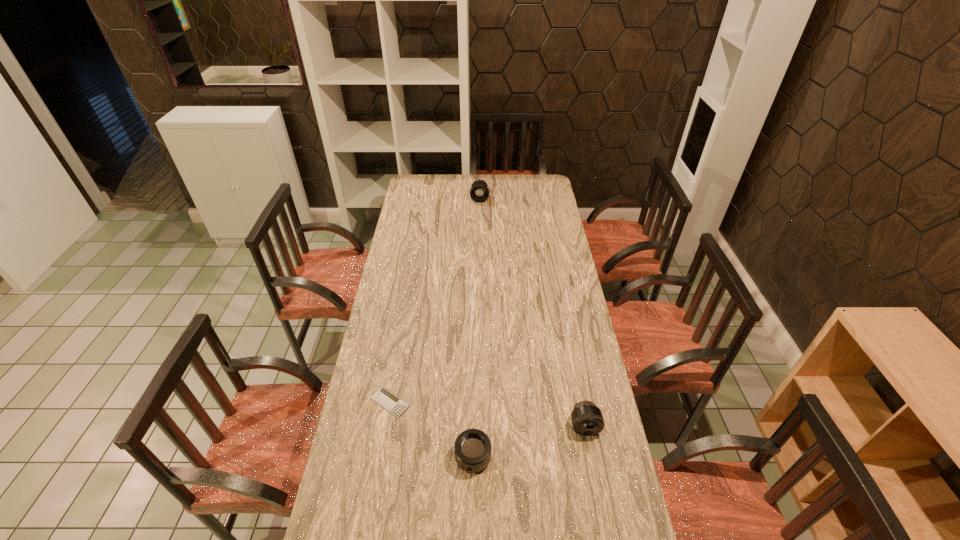
This screenshot has width=960, height=540. Identify the location of the farthest object. (479, 192).

You are a GUI agent. You are given a task and a screenshot of the screen. Output one action in this format:
    pyautogui.click(x=<x>, y=<y>)
    Task: Click on the rightmost object
    
    Given the screenshot: What is the action you would take?
    pyautogui.click(x=587, y=419)

At what (x,y) coordinates should I click in order to perform the action: click on the second farthest telephoto lens. Please return your answer as a coordinate pair (x, y). Image resolution: width=960 pixels, height=540 pixels. Looking at the image, I should click on 587,419.

Find the location of a particular element. the nearest telephoto lens is located at coordinates (472, 448).

Find the location of a particular element. Image resolution: width=960 pixels, height=540 pixels. the nearest object is located at coordinates (472, 448).

Locate an element on the screen. the leftmost object is located at coordinates (389, 401).

Where is `calculator`? calculator is located at coordinates (389, 401).

Image resolution: width=960 pixels, height=540 pixels. I want to click on vacant space located at the front element of the farthest object, so click(x=480, y=228).

I want to click on vacant area situated on the front-facing side of the second farthest telephoto lens, so click(590, 456).

Identify the location of free space located 0.100m on the side of the nearest telephoto lens with brand markings and control switches. This screenshot has width=960, height=540. (472, 511).